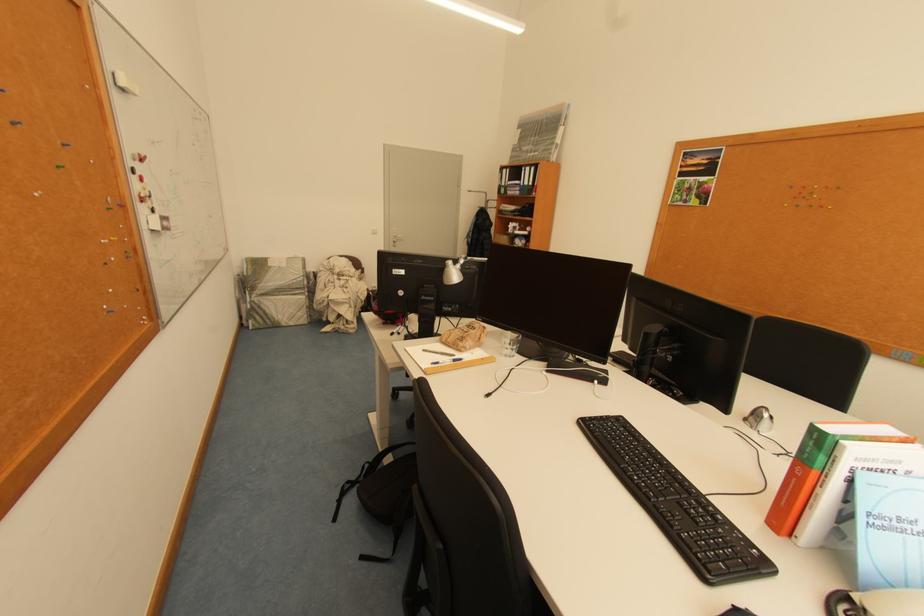
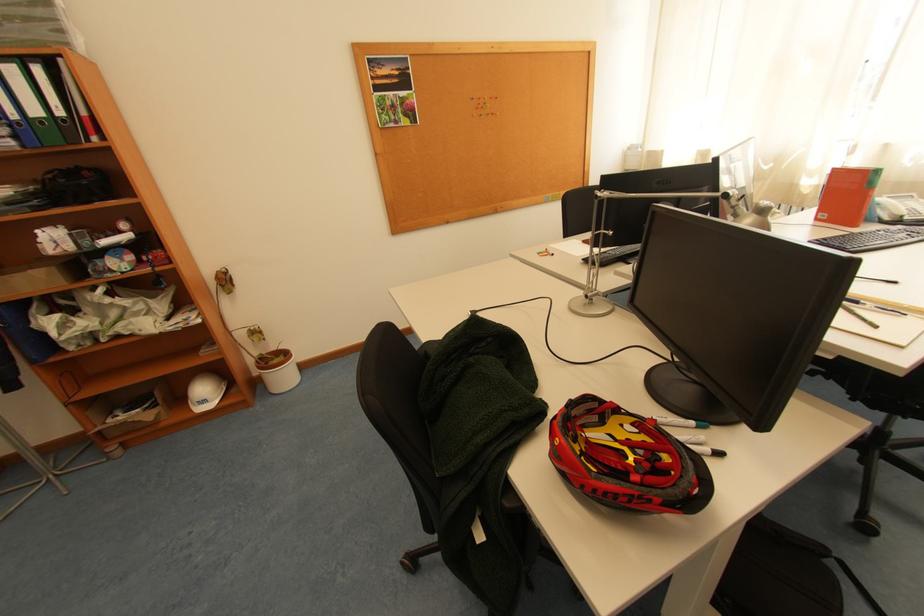
In the second image, find the point that corresponds to the point at 528,192 in the first image.

(23, 139)